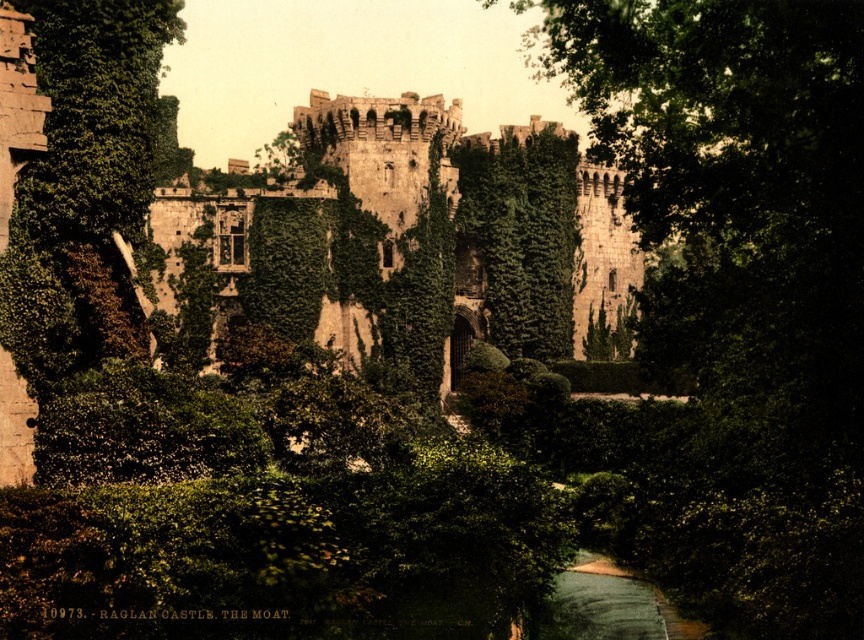
You are standing at the edge of Raglan Castle moat and see a point marked at coordinates (x=739, y=291). What object is located at that point?

The point at coordinates (x=739, y=291) corresponds to a green leafy tree at center.

You are planning to take a photo of both the green leafy tree at center and the stone castle at center from a distance. Which object will appear wider in the photo?

The stone castle at center will appear wider in the photo because its width is greater than the green leafy tree at center.

You are standing in the garden of Raglan Castle and notice both the green leafy tree at center and the stone castle at center. Which object appears taller from your current viewpoint?

The green leafy tree at center is taller than the stone castle at center, so it appears taller from your current viewpoint.